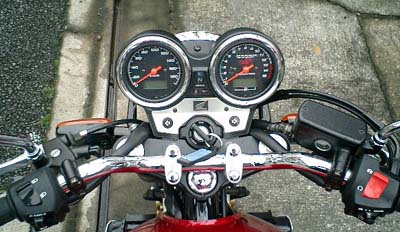
Identify the location of switch. This screenshot has height=232, width=400. click(379, 185).